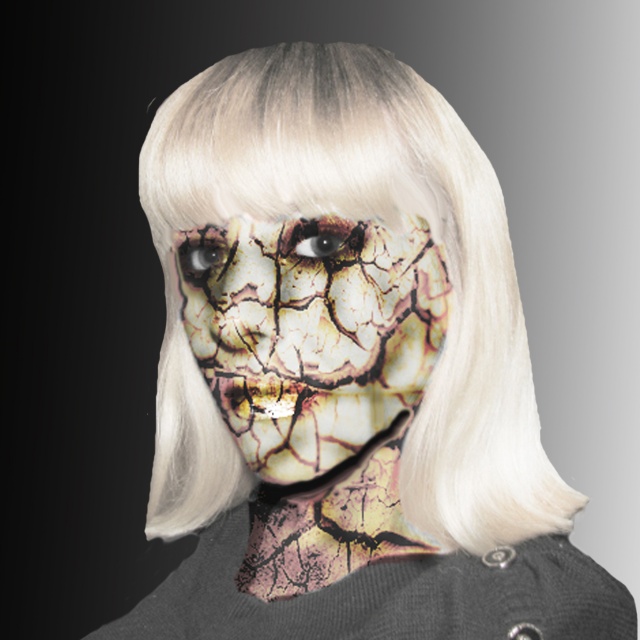
Question: Which point is farther to the camera?

Choices:
 (A) (317, 236)
 (B) (291, 115)
 (C) (248, 234)
 (D) (218, 241)

Answer: (D)

Question: Which of the following is the closest to the observer?

Choices:
 (A) (298, 252)
 (B) (440, 433)

Answer: (A)

Question: Estimate the real-world distances between objects in this image. Which object is farther from the cracked clay mask at center?

Choices:
 (A) brown textured eye at center
 (B) shiny black eye at center

Answer: (B)

Question: Does blonde synthetic wig at center appear on the left side of brown textured eye at center?

Choices:
 (A) no
 (B) yes

Answer: (A)

Question: Where is blonde synthetic wig at center located in relation to cracked clay mask at center in the image?

Choices:
 (A) above
 (B) below

Answer: (B)

Question: Is the position of blonde synthetic wig at center more distant than that of shiny black eye at center?

Choices:
 (A) no
 (B) yes

Answer: (A)